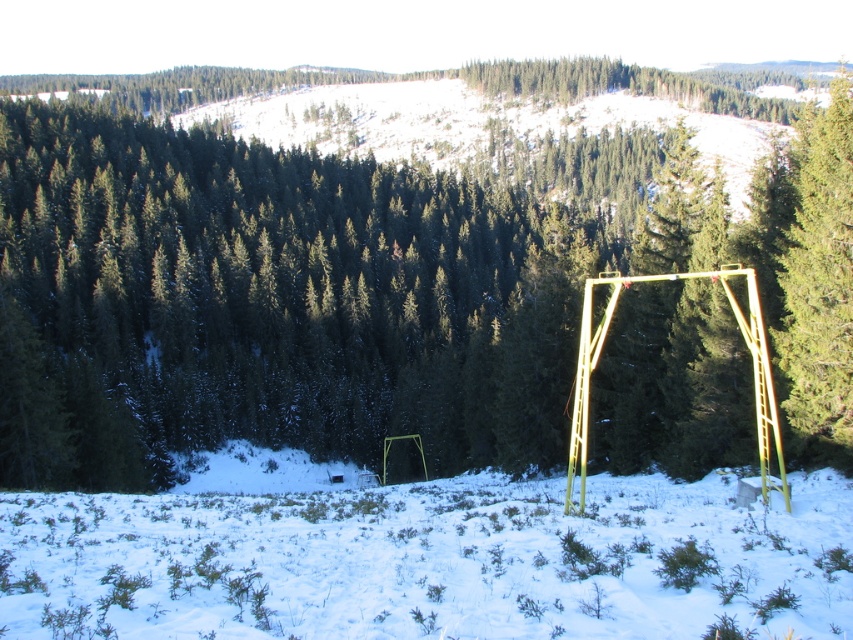
Between point (404, 561) and point (822, 336), which one is positioned behind?

The point (822, 336) is behind.

The height and width of the screenshot is (640, 853). In order to click on white powdery snow at lower center in this screenshot , I will do `click(430, 561)`.

Is green matte swing at center to the right of white powdery snow at lower center from the viewer's perspective?

Yes, green matte swing at center is to the right of white powdery snow at lower center.

Can you confirm if green matte swing at center is shorter than white powdery snow at lower center?

Incorrect, green matte swing at center's height does not fall short of white powdery snow at lower center's.

Is point (112, 282) in front of point (602, 488)?

No.

You are a GUI agent. You are given a task and a screenshot of the screen. Output one action in this format:
    pyautogui.click(x=<x>, y=<y>)
    Task: Click on the green matte swing at center
    The image size is (853, 640).
    Given the screenshot: What is the action you would take?
    pyautogui.click(x=368, y=291)

Which is below, green matte swing at center or green matte tree at center-right?

green matte tree at center-right is lower down.

Which is more to the left, green matte swing at center or green matte tree at center-right?

From the viewer's perspective, green matte swing at center appears more on the left side.

Between point (546, 241) and point (793, 292), which one is positioned behind?

The point (546, 241) is behind.

You are a GUI agent. You are given a task and a screenshot of the screen. Output one action in this format:
    pyautogui.click(x=<x>, y=<y>)
    Task: Click on the green matte swing at center
    
    Given the screenshot: What is the action you would take?
    pyautogui.click(x=368, y=291)